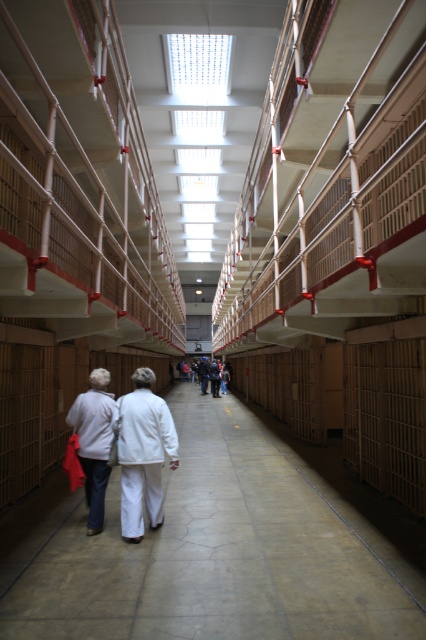
Who is more distant from viewer, (94, 444) or (215, 387)?

Positioned behind is point (215, 387).

The width and height of the screenshot is (426, 640). What do you see at coordinates (94, 442) in the screenshot? I see `white fabric pants at center` at bounding box center [94, 442].

What do you see at coordinates (94, 442) in the screenshot? The height and width of the screenshot is (640, 426). I see `white fabric pants at center` at bounding box center [94, 442].

Image resolution: width=426 pixels, height=640 pixels. In order to click on white fabric pants at center in this screenshot , I will do [x=94, y=442].

Is white fabric at center positioned at the back of dark blue jeans at center?

No, it is in front of dark blue jeans at center.

Between white fabric at center and dark blue jeans at center, which one is positioned lower?

Positioned lower is dark blue jeans at center.

Is point (129, 497) farther from camera compared to point (203, 385)?

That is False.

This screenshot has height=640, width=426. Identify the location of white fabric at center. (129, 442).

Is white fabric at center to the left of dark gray sweater at center from the viewer's perspective?

Correct, you'll find white fabric at center to the left of dark gray sweater at center.

Can you confirm if white fabric at center is positioned below dark gray sweater at center?

No, white fabric at center is not below dark gray sweater at center.

Who is more forward, (120,442) or (213,371)?

Point (120,442)

Locate an element on the screen. The width and height of the screenshot is (426, 640). white fabric at center is located at coordinates (129, 442).